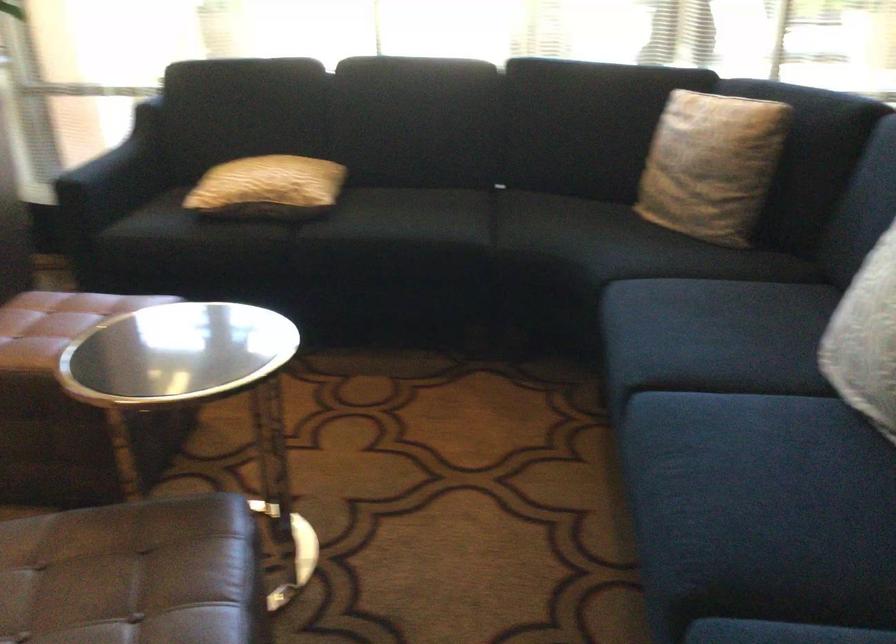
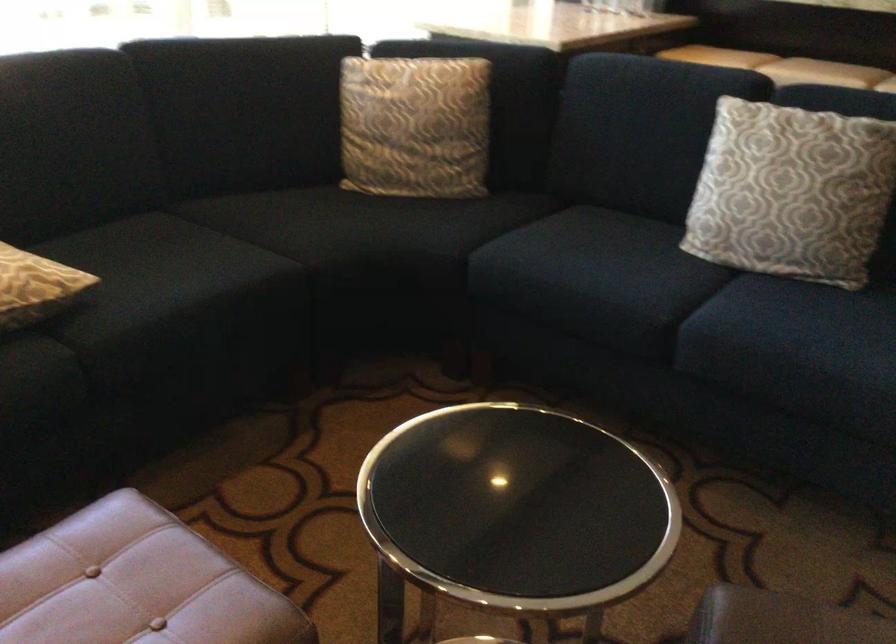
The point at (695,160) is marked in the first image. Where is the corresponding point in the second image?

(415, 126)